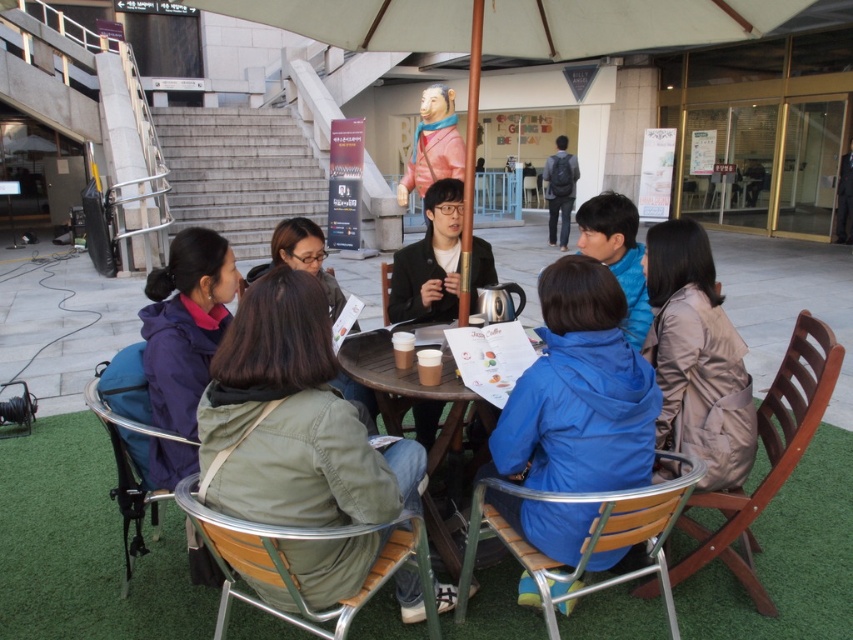
Question: Considering the real-world distances, which object is closest to the metallic silver chair at lower left?

Choices:
 (A) blue matte jacket at center
 (B) green fabric chair at center
 (C) wooden chair at lower right
 (D) green fabric jacket at lower left

Answer: (B)

Question: Which object appears closest to the camera in this image?

Choices:
 (A) green fabric chair at center
 (B) wooden table at center
 (C) wooden chair at center

Answer: (A)

Question: Is blue matte jacket at center wider than brown leather jacket at right?

Choices:
 (A) no
 (B) yes

Answer: (B)

Question: Does brown leather jacket at right come in front of dark gray backpack at center?

Choices:
 (A) no
 (B) yes

Answer: (B)

Question: Does blue matte jacket at center appear under green fabric chair at center?

Choices:
 (A) no
 (B) yes

Answer: (A)

Question: Based on their relative distances, which object is nearer to the metallic silver chair at lower left?

Choices:
 (A) wooden chair at center
 (B) dark gray backpack at center
 (C) blue matte jacket at center

Answer: (C)